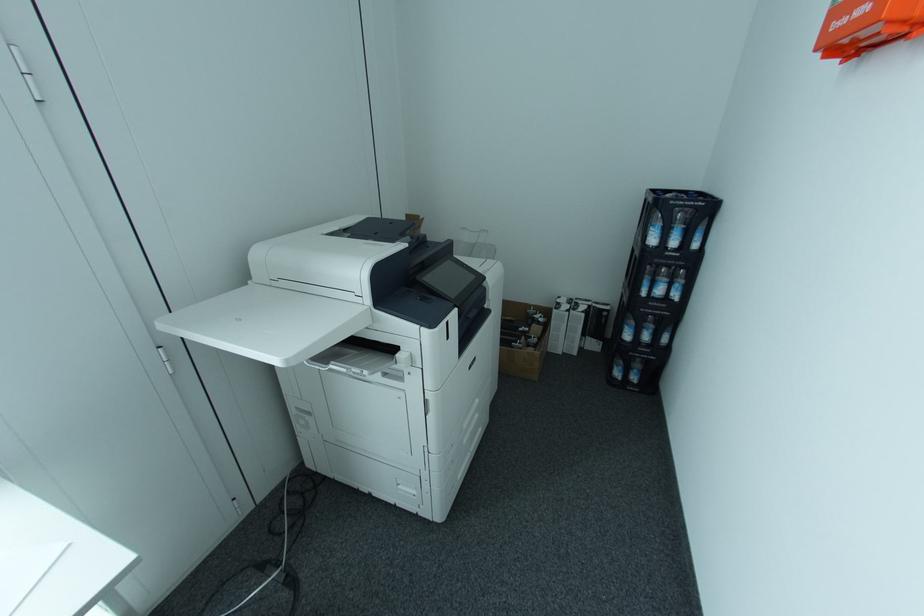
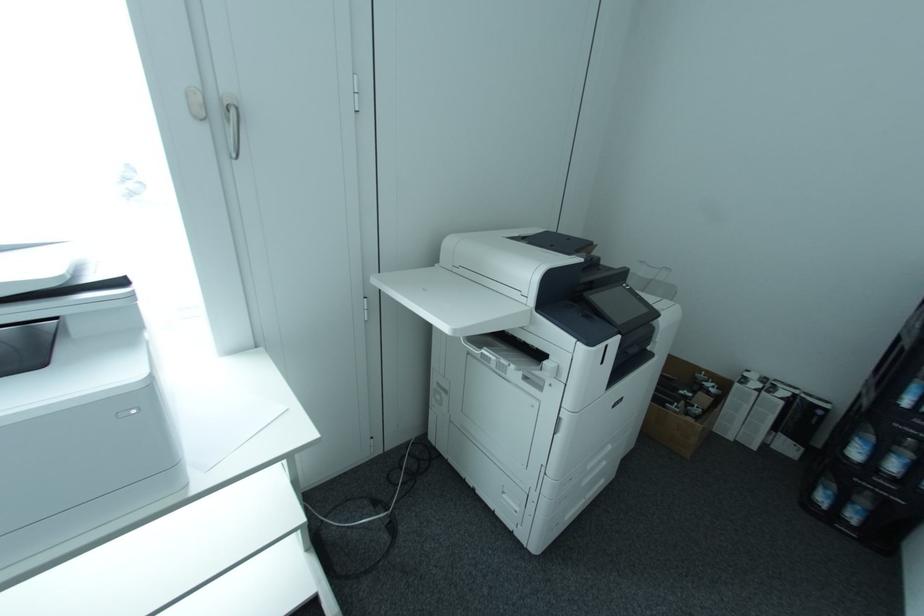
Question: Based on the continuous images, in which direction is the camera rotating? Reply with the corresponding letter.

Choices:
 (A) Left
 (B) Right
 (C) Up
 (D) Down

Answer: (A)